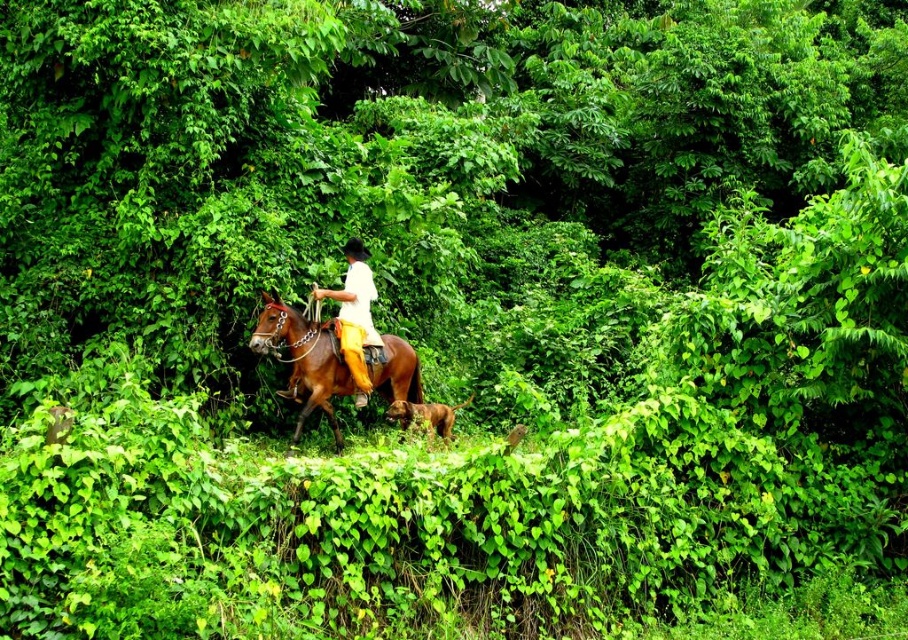
Is brown glossy horse at center to the left of yellow fabric pants at center from the viewer's perspective?

Yes, brown glossy horse at center is to the left of yellow fabric pants at center.

Is point (333, 355) positioned in front of point (373, 344)?

Yes, it is.

Between point (337, 348) and point (368, 312), which one is positioned in front?

Point (337, 348)

Where is `brown glossy horse at center`? The height and width of the screenshot is (640, 908). brown glossy horse at center is located at coordinates (304, 358).